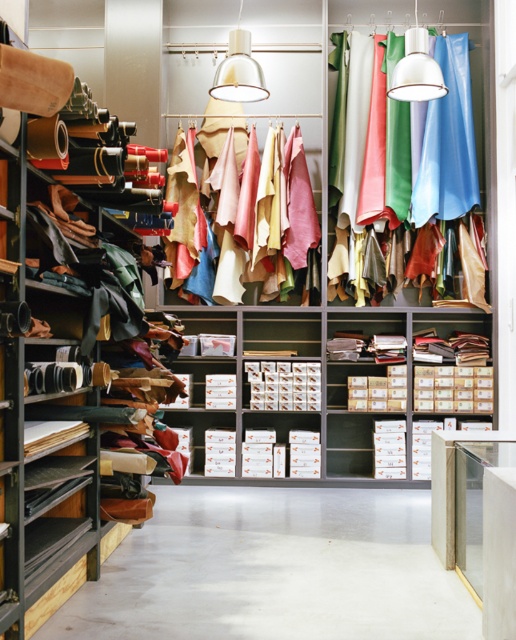
Question: Is shiny leather fabric at upper center to the left of matte blue leather jacket at upper right from the viewer's perspective?

Choices:
 (A) no
 (B) yes

Answer: (B)

Question: Which point appears closest to the camera in this image?

Choices:
 (A) (447, 176)
 (B) (381, 81)
 (C) (256, 196)

Answer: (C)

Question: Does shiny leather fabric at upper center appear over matte blue leather jacket at upper right?

Choices:
 (A) yes
 (B) no

Answer: (B)

Question: Which point is farther to the camera?

Choices:
 (A) (301, 195)
 (B) (448, 193)
 (C) (357, 138)

Answer: (C)

Question: Which object appears closest to the camera in this image?

Choices:
 (A) shiny leather fabric at upper center
 (B) suede leather at center

Answer: (B)

Question: Is shiny leather fabric at upper center wider than suede leather at center?

Choices:
 (A) no
 (B) yes

Answer: (B)